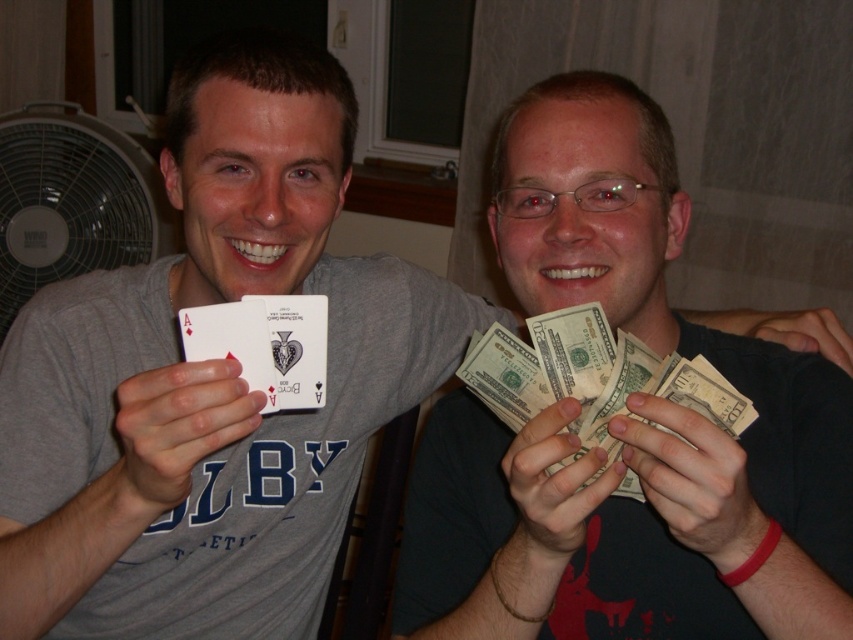
Question: Does white plastic fan at left have a lesser width compared to smooth paper money at lower right?

Choices:
 (A) yes
 (B) no

Answer: (B)

Question: Based on their relative distances, which object is farther from the white matte card at center?

Choices:
 (A) matte plastic playing card at center
 (B) black matte hand at center
 (C) smooth paper money at center
 (D) green paper money at right

Answer: (B)

Question: Does smooth paper money at lower right have a greater width compared to smooth paper money at center?

Choices:
 (A) no
 (B) yes

Answer: (B)

Question: Which object is the farthest from the white matte card at center?

Choices:
 (A) smooth paper money at lower right
 (B) smooth paper money at center
 (C) green paper money at right

Answer: (A)

Question: Which object is positioned closest to the green paper money at right?

Choices:
 (A) matte plastic playing card at center
 (B) white matte card at center
 (C) smooth paper money at center

Answer: (C)

Question: Does white plastic fan at left have a greater width compared to matte plastic playing card at center?

Choices:
 (A) no
 (B) yes

Answer: (B)